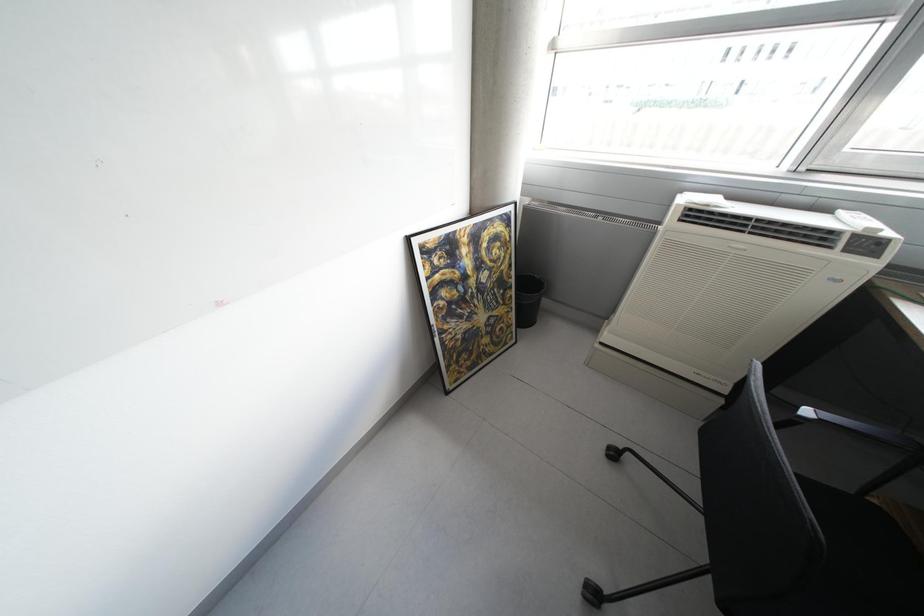
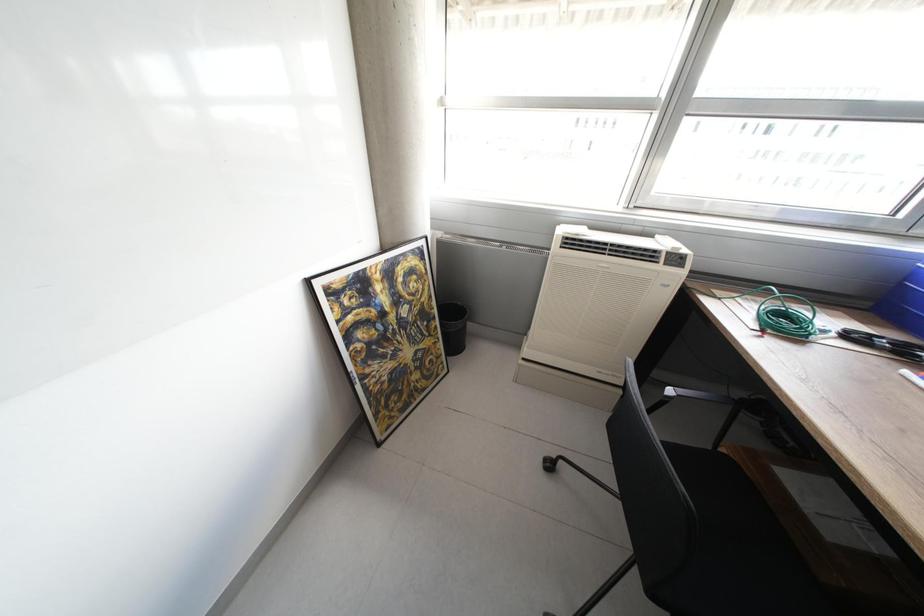
Question: The first image is from the beginning of the video and the second image is from the end. How did the camera likely rotate when shooting the video?

Choices:
 (A) Left
 (B) Right
 (C) Up
 (D) Down

Answer: (B)